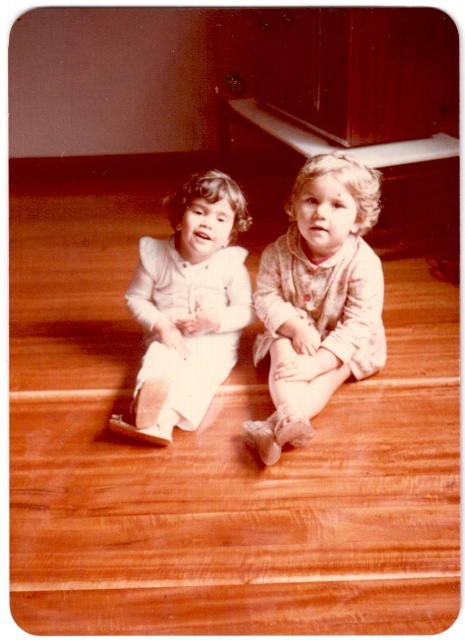
Is fluffy pink pajamas at center closer to camera compared to white satin dress at center?

Yes, fluffy pink pajamas at center is in front of white satin dress at center.

From the picture: Who is lower down, fluffy pink pajamas at center or white satin dress at center?

white satin dress at center

Is point (284, 436) in front of point (225, 214)?

Yes.

Where is `fluffy pink pajamas at center`? fluffy pink pajamas at center is located at coordinates (318, 300).